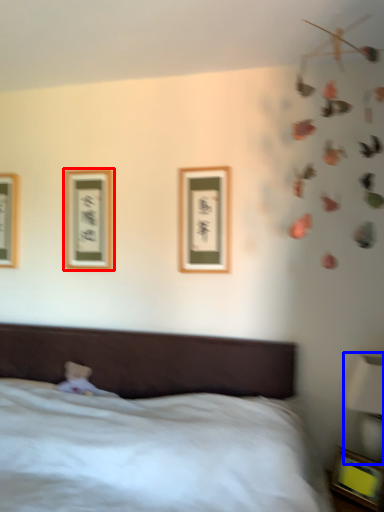
Question: Which point is closer to the camera, picture frame (highlighted by a red box) or bedside lamp (highlighted by a blue box)?

Choices:
 (A) picture frame
 (B) bedside lamp

Answer: (B)